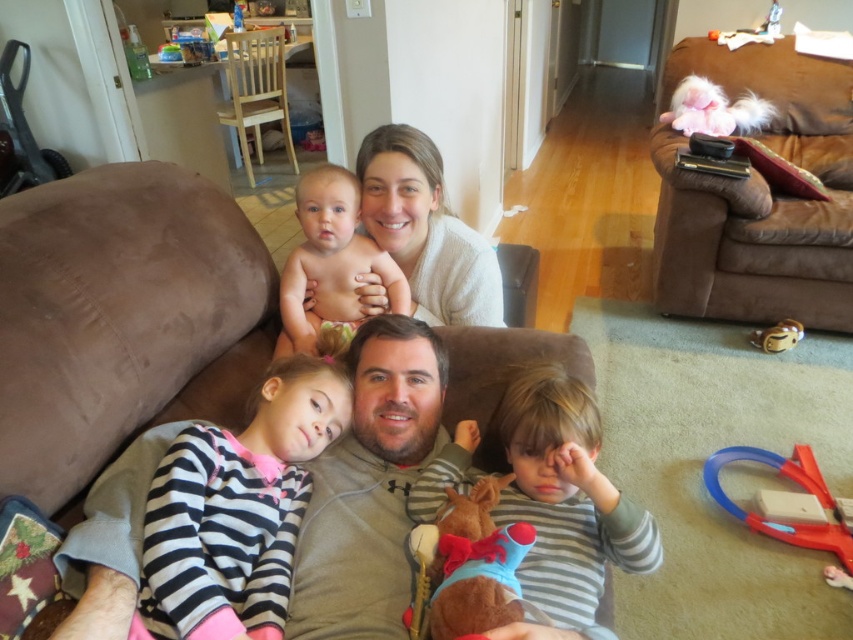
You are a parent trying to retrieve the blue plastic train at lower right for your child. The nude skin baby at upper center is in your way. Can you reach the train without moving the baby?

The nude skin baby at upper center is in front of the blue plastic train at lower right, so you cannot reach the train without moving the baby.

You are a photographer taking a family portrait. You notice the nude skin baby at upper center is at point coordinates of (329, 260). If you want to position the baby in the center of the frame, which direction should you move the camera? Please answer with either left, right, up, or down.

The point coordinates are given as (329, 260). In standard image coordinate systems, the origin is typically at the top left corner. The x coordinate 0.409 is the horizontal position, and the y coordinate 0.388 is the vertical position. To center the baby horizontally, since 0.409 is less than 0.5, the baby is to the left of center. To center vertically, since 0.388 is less than 0.5, the baby is above the center. Therefore, to move the baby to the center, you should move the camera to the right and down.